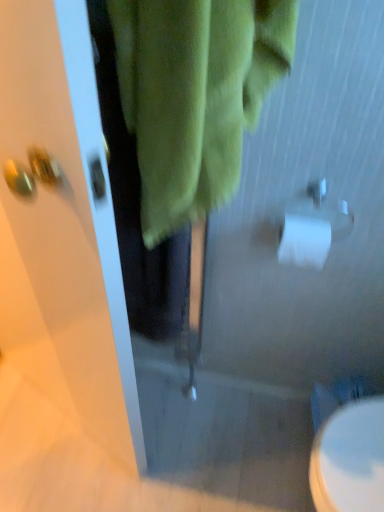
Question: Considering the positions of white matte toilet paper at right and white glossy toilet at lower right in the image, is white matte toilet paper at right bigger or smaller than white glossy toilet at lower right?

Choices:
 (A) small
 (B) big

Answer: (A)

Question: Considering their positions, is white matte toilet paper at right located in front of or behind white glossy toilet at lower right?

Choices:
 (A) behind
 (B) front

Answer: (B)

Question: Looking at their shapes, would you say white matte toilet paper at right is wider or thinner than white glossy toilet at lower right?

Choices:
 (A) wide
 (B) thin

Answer: (B)

Question: Would you say white glossy toilet at lower right is to the left or to the right of white matte toilet paper at right in the picture?

Choices:
 (A) right
 (B) left

Answer: (A)

Question: Is white glossy toilet at lower right inside the boundaries of white matte toilet paper at right, or outside?

Choices:
 (A) outside
 (B) inside

Answer: (A)

Question: In terms of height, does white glossy toilet at lower right look taller or shorter compared to white matte toilet paper at right?

Choices:
 (A) tall
 (B) short

Answer: (A)

Question: From a real-world perspective, is white glossy toilet at lower right above or below white matte toilet paper at right?

Choices:
 (A) below
 (B) above

Answer: (A)